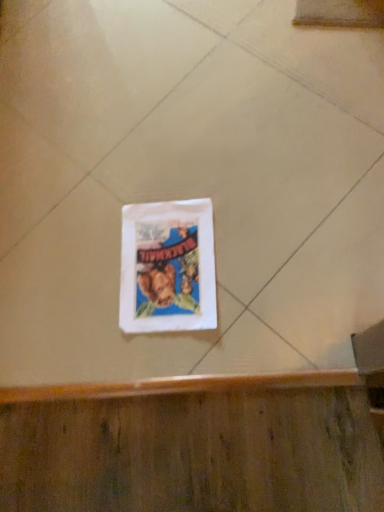
Identify the location of free space in front of white paper bag at center. (224, 343).